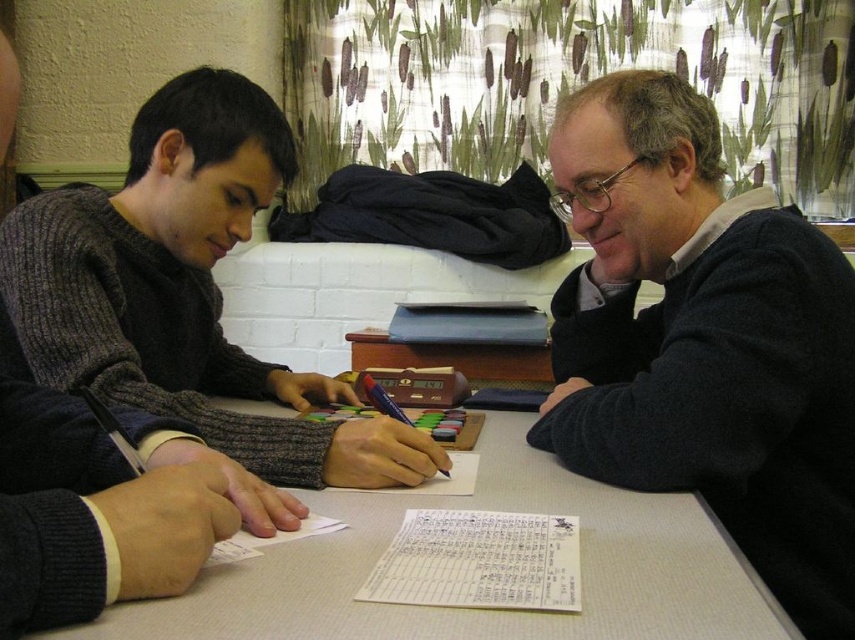
Is dark blue sweater at right further to the viewer compared to white paper at center?

Yes, it is.

Does point (693, 372) lie behind point (496, 572)?

Yes, point (693, 372) is behind point (496, 572).

Locate an element on the screen. The height and width of the screenshot is (640, 855). dark blue sweater at right is located at coordinates (705, 340).

The width and height of the screenshot is (855, 640). Find the location of `dark blue sweater at right`. dark blue sweater at right is located at coordinates (705, 340).

Who is higher up, dark blue sweater at right or white textured table at center?

dark blue sweater at right is higher up.

Does point (644, 115) come in front of point (420, 621)?

No, it is not.

You are a GUI agent. You are given a task and a screenshot of the screen. Output one action in this format:
    pyautogui.click(x=<x>, y=<y>)
    Task: Click on the dark blue sweater at right
    This screenshot has height=640, width=855.
    Given the screenshot: What is the action you would take?
    pyautogui.click(x=705, y=340)

Can you confirm if dark blue sweater at right is smaller than dark gray sweater at left?

Correct, dark blue sweater at right occupies less space than dark gray sweater at left.

Who is more distant from viewer, [846,429] or [164,371]?

Point [164,371]

At what (x,y) coordinates should I click in order to perform the action: click on dark blue sweater at right. Please return your answer as a coordinate pair (x, y). Image resolution: width=855 pixels, height=640 pixels. Looking at the image, I should click on (705, 340).